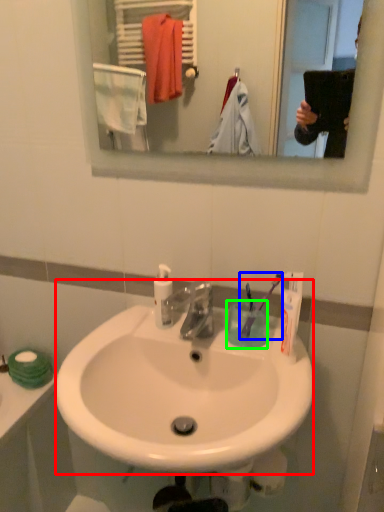
Question: Considering the real-world distances, which object is farthest from sink (highlighted by a red box)? toothbrush (highlighted by a blue box) or coffee cup (highlighted by a green box)?

Choices:
 (A) toothbrush
 (B) coffee cup

Answer: (A)